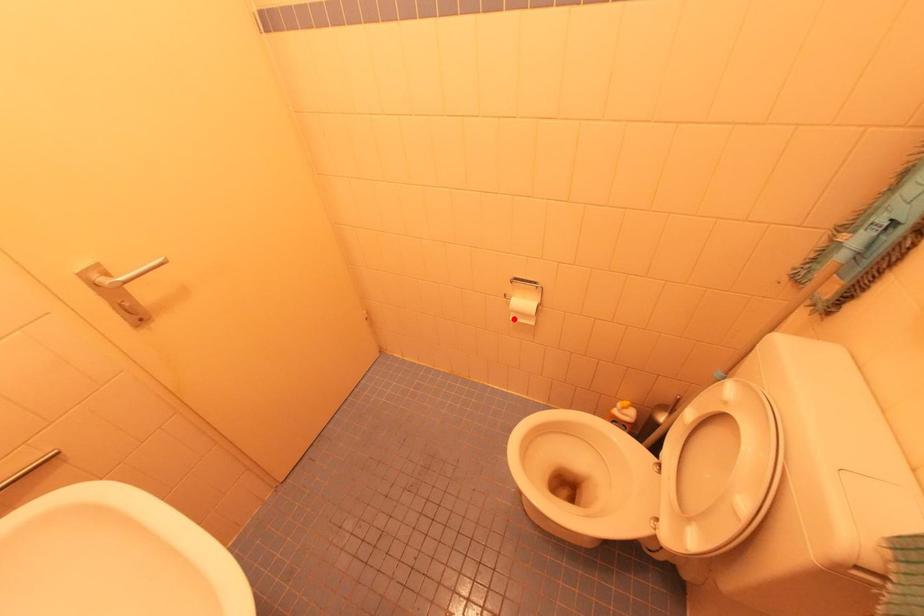
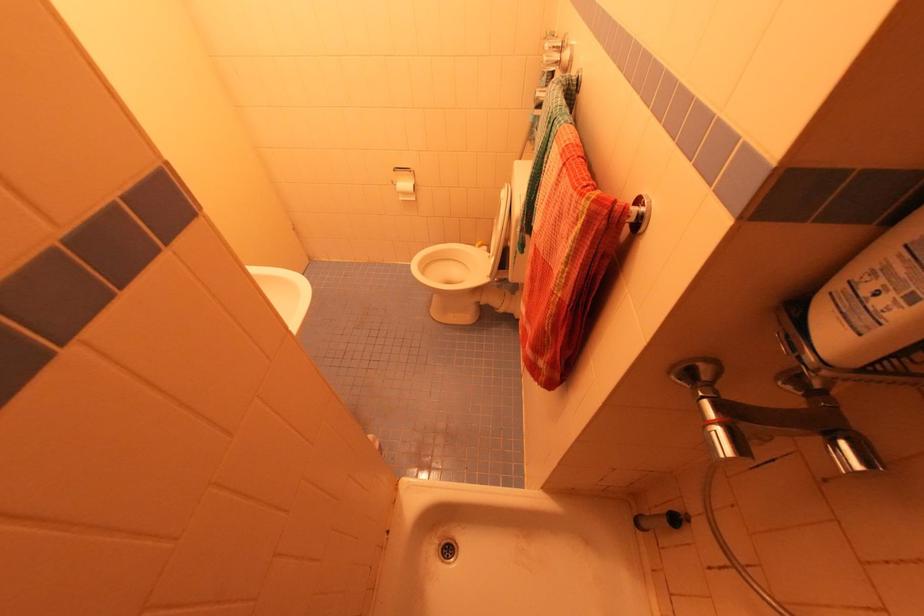
Locate, in the second image, the point that corresponds to the highlighted location in the first image.

(403, 200)